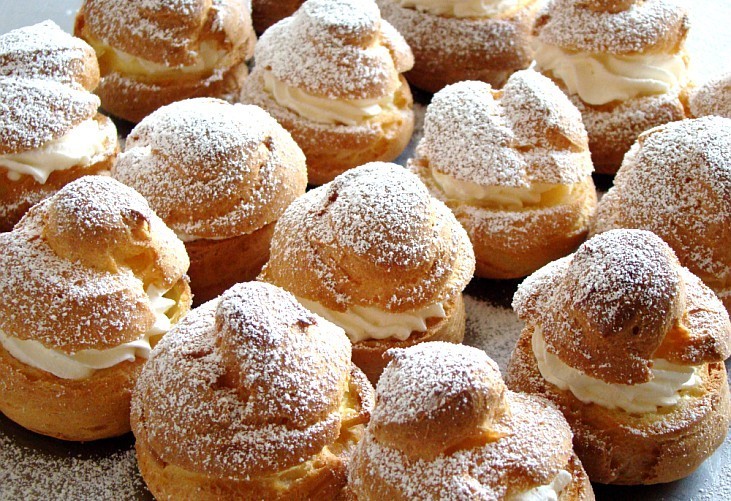
The image size is (731, 501). Find the location of `table`. table is located at coordinates (52, 459).